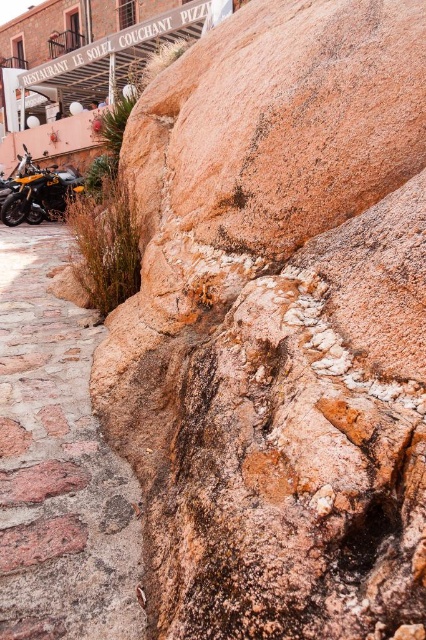
Can you confirm if stone paved path at lower left is smaller than orange matte motorcycle at left?

Actually, stone paved path at lower left might be larger than orange matte motorcycle at left.

Can you confirm if stone paved path at lower left is positioned to the left of orange matte motorcycle at left?

In fact, stone paved path at lower left is to the right of orange matte motorcycle at left.

Is point (48, 358) in front of point (5, 216)?

Yes, it is.

At what (x,y) coordinates should I click in order to perform the action: click on stone paved path at lower left. Please return your answer as a coordinate pair (x, y). Looking at the image, I should click on (57, 465).